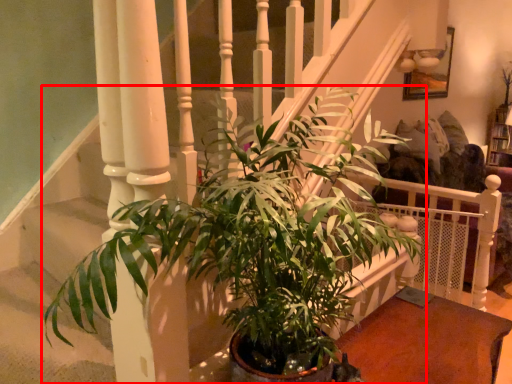
Question: From the image, what is the correct spatial relationship of houseplant (annotated by the red box) in relation to table?

Choices:
 (A) left
 (B) right

Answer: (A)